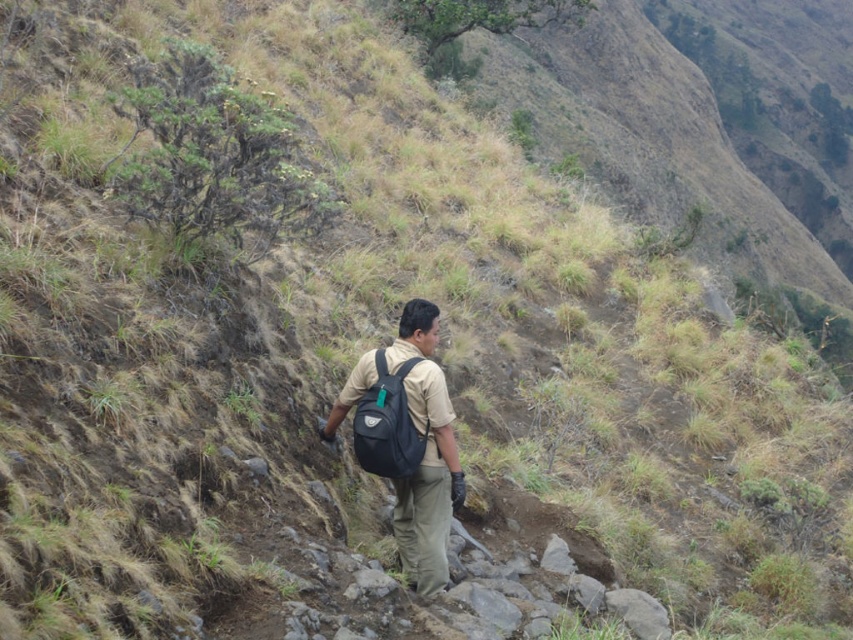
Does matte black backpack at center have a smaller size compared to navy blue fabric backpack at center?

Incorrect, matte black backpack at center is not smaller in size than navy blue fabric backpack at center.

Who is higher up, matte black backpack at center or navy blue fabric backpack at center?

navy blue fabric backpack at center is above.

Describe the element at coordinates (408, 440) in the screenshot. Image resolution: width=853 pixels, height=640 pixels. I see `matte black backpack at center` at that location.

This screenshot has height=640, width=853. In order to click on matte black backpack at center in this screenshot , I will do `click(408, 440)`.